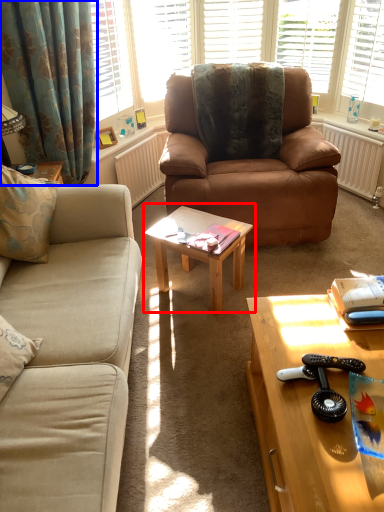
Question: Which point is closer to the camera, coffee table (highlighted by a red box) or curtain (highlighted by a blue box)?

Choices:
 (A) coffee table
 (B) curtain

Answer: (A)